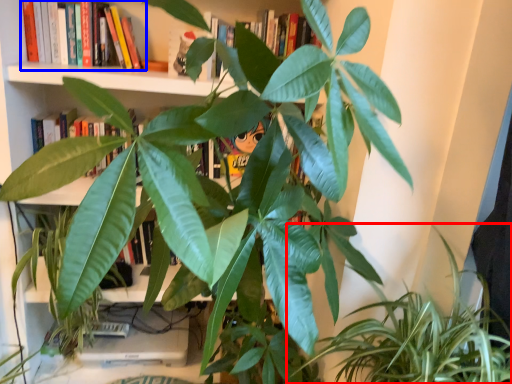
Question: Which object is further to the camera taking this photo, houseplant (highlighted by a red box) or book (highlighted by a blue box)?

Choices:
 (A) houseplant
 (B) book

Answer: (B)